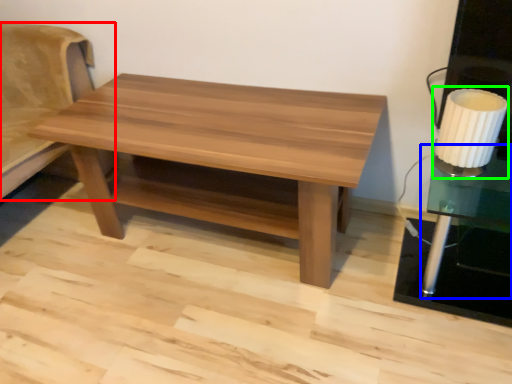
Question: Which object is positioned closest to futon (highlighted by a red box)? Select from side table (highlighted by a blue box) and table lamp (highlighted by a green box).

Choices:
 (A) side table
 (B) table lamp

Answer: (B)